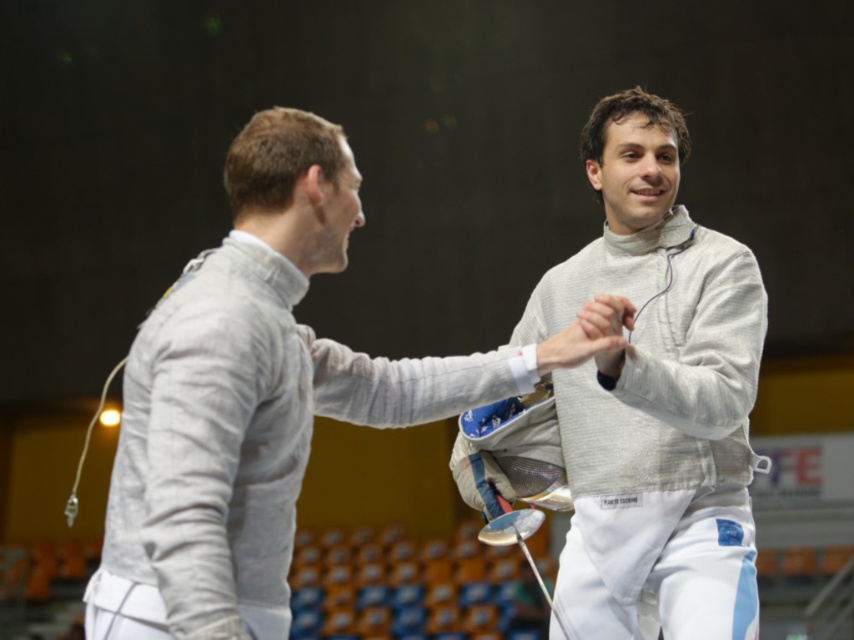
You are a photographer at a fencing event. You need to capture a photo of both the white fabric fencing uniform at left and the white matte fencing uniform at center. Which uniform should you focus on first to ensure it fits within the frame if your camera has limited zoom?

The white fabric fencing uniform at left is smaller than the white matte fencing uniform at center, so you should focus on the white matte fencing uniform at center first to ensure it fits within the frame before adjusting for the smaller one.

You are a photographer setting up for a fencing event. You need to position a backdrop that is 1.8 meters wide. The backdrop must be placed behind both the white fabric fencing uniform at left and the white matte fencing uniform at center. Based on their widths, will the backdrop be wide enough to cover both uniforms without overlapping?

The white fabric fencing uniform at left is wider than the white matte fencing uniform at center. Since the backdrop is 1.8 meters wide, it should be sufficient to cover both uniforms as long as their combined width does not exceed the backdrop width. However, without exact measurements of each uniform, we cannot confirm definitively. But since the fabric uniform is wider, ensure it is centered to maximize coverage.

Looking at this image, you are a photographer at a fencing competition. You want to take a photo where the white fabric fencing uniform at left is visible above the white matte fencing uniform at center. Is this possible given their current positions?

The white fabric fencing uniform at left is positioned under the white matte fencing uniform at center, so it cannot be visible above it in the current arrangement.